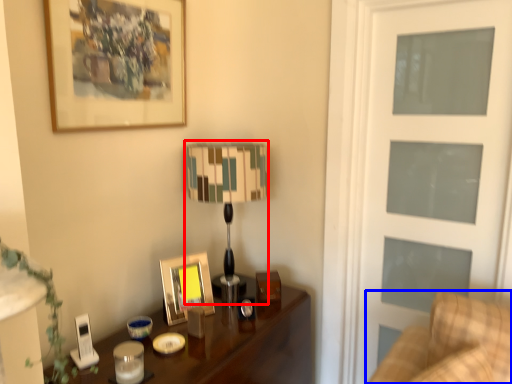
Question: Which of the following is the closest to the observer, table lamp (highlighted by a red box) or furniture (highlighted by a blue box)?

Choices:
 (A) table lamp
 (B) furniture

Answer: (B)